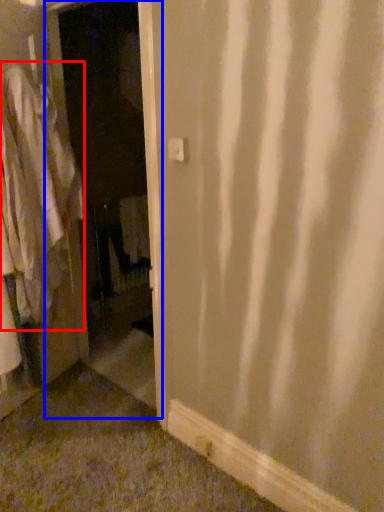
Question: Which object is further to the camera taking this photo, clothing (highlighted by a red box) or screen door (highlighted by a blue box)?

Choices:
 (A) clothing
 (B) screen door

Answer: (A)